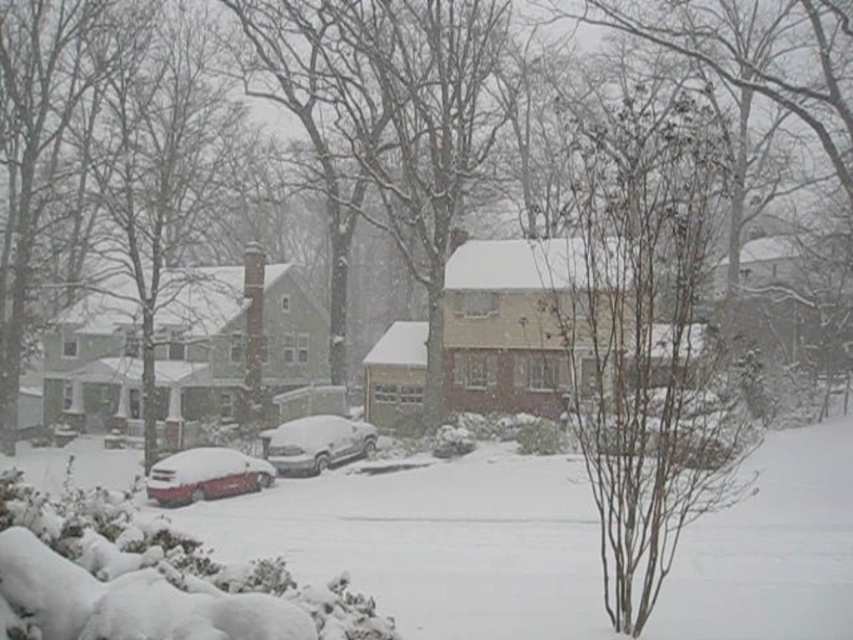
Looking at this image, you are a delivery person trying to navigate through the snow. You see the bare branches at center and the sleek silver sedan at center. Which one is larger in size?

The bare branches at center is bigger than the sleek silver sedan at center, so the bare branches at center is larger in size.

You are standing in the winter scene and want to take a photo of the bare branches at center and the sleek silver sedan at center. Which object should you focus on first if you want both to be in sharp focus?

You should focus on the bare branches at center first because it is closer to the viewer than the sleek silver sedan at center, ensuring both will be in focus when using a camera with proper depth of field settings.